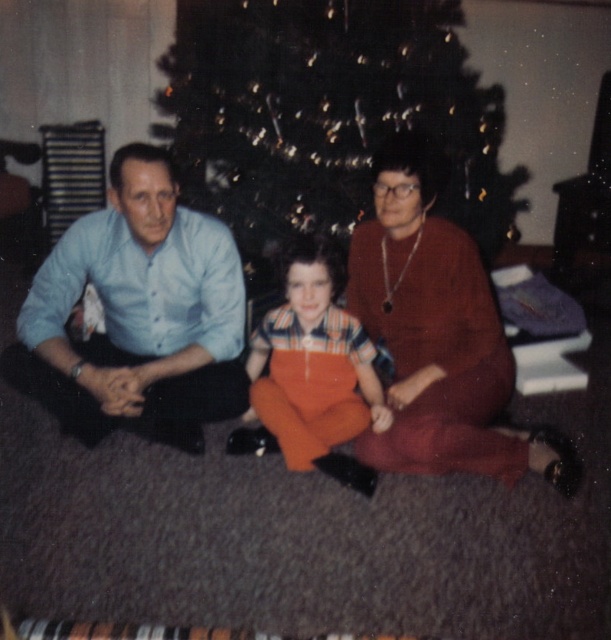
Question: Where is matte blue shirt at left located in relation to matte blue shirt at center in the image?

Choices:
 (A) below
 (B) above

Answer: (B)

Question: Does light blue shirt at left appear on the right side of matte blue shirt at center?

Choices:
 (A) no
 (B) yes

Answer: (A)

Question: Which point appears closest to the camera in this image?

Choices:
 (A) (87, 378)
 (B) (573, 476)
 (C) (112, 410)
 (D) (327, 429)

Answer: (B)

Question: Can you confirm if light blue shirt at left is thinner than orange cotton overalls at center?

Choices:
 (A) no
 (B) yes

Answer: (A)

Question: Which object is closer to the camera taking this photo?

Choices:
 (A) green textured christmas tree at center
 (B) light blue shirt at left

Answer: (B)

Question: Which object is closer to the camera taking this photo?

Choices:
 (A) light blue shirt at left
 (B) matte blue shirt at center

Answer: (B)